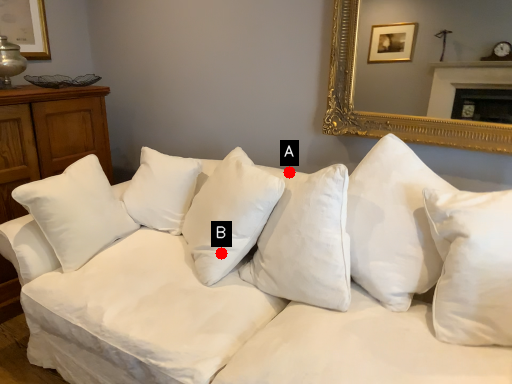
Question: Two points are circled on the image, labeled by A and B beside each circle. Among these points, which one is farthest from the camera?

Choices:
 (A) A is further
 (B) B is further

Answer: (B)